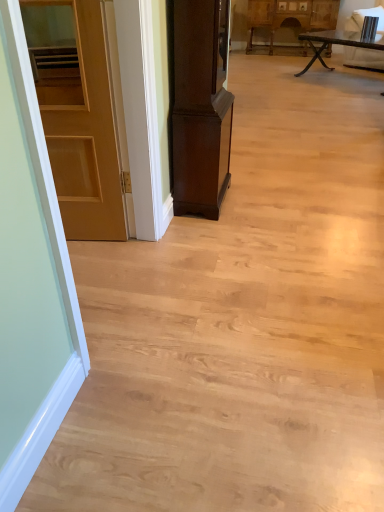
Where is `vacant space in front of dark wood cabinet at center, the first cabinetry when ordered from left to right`? The image size is (384, 512). vacant space in front of dark wood cabinet at center, the first cabinetry when ordered from left to right is located at coordinates (228, 236).